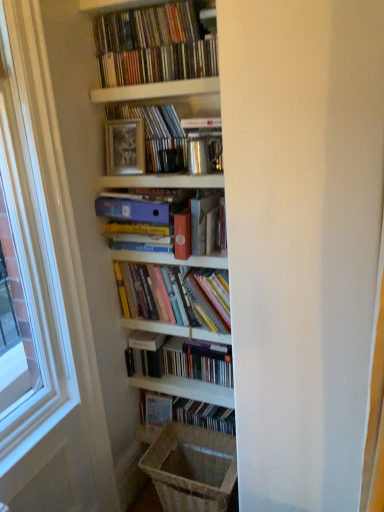
Question: In terms of width, does matte pink paperback at center look wider or thinner when compared to matte plastic folder at center, which ranks as the 4th book in bottom-to-top order?

Choices:
 (A) wide
 (B) thin

Answer: (B)

Question: Is matte pink paperback at center situated inside matte plastic folder at center, which ranks as the 4th book in bottom-to-top order, or outside?

Choices:
 (A) outside
 (B) inside

Answer: (A)

Question: Which of these objects is positioned closest to the hardcover books at center, which ranks as the third book in bottom-to-top order?

Choices:
 (A) wooden framed picture at upper center
 (B) hardcover books at center, which is counted as the 5th book, starting from the top
 (C) white glossy shelf at upper center
 (D) matte pink paperback at center
 (E) white wood window frame at left

Answer: (B)

Question: Which object is positioned farthest from the hardcover book at center, which is the fifth book in bottom-to-top order?

Choices:
 (A) matte black books at center, the 6th book positioned from the top
 (B) matte pink paperback at center
 (C) brown woven laundry basket at lower center
 (D) wooden framed picture at upper center
 (E) hardcover books at center, which is counted as the 4th book, starting from the top

Answer: (C)